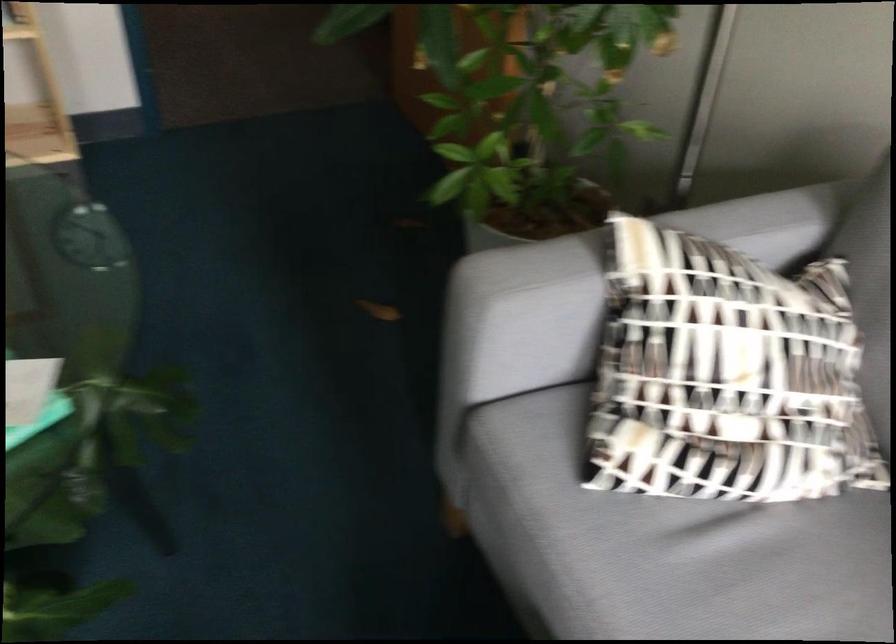
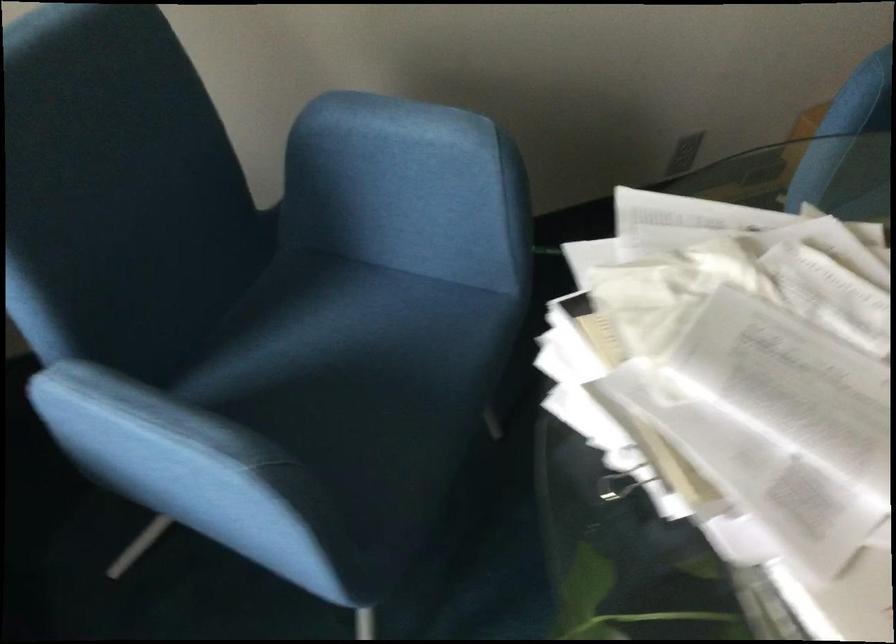
The images are taken continuously from a first-person perspective. In which direction is your viewpoint rotating?

The camera's rotation is toward left-down.